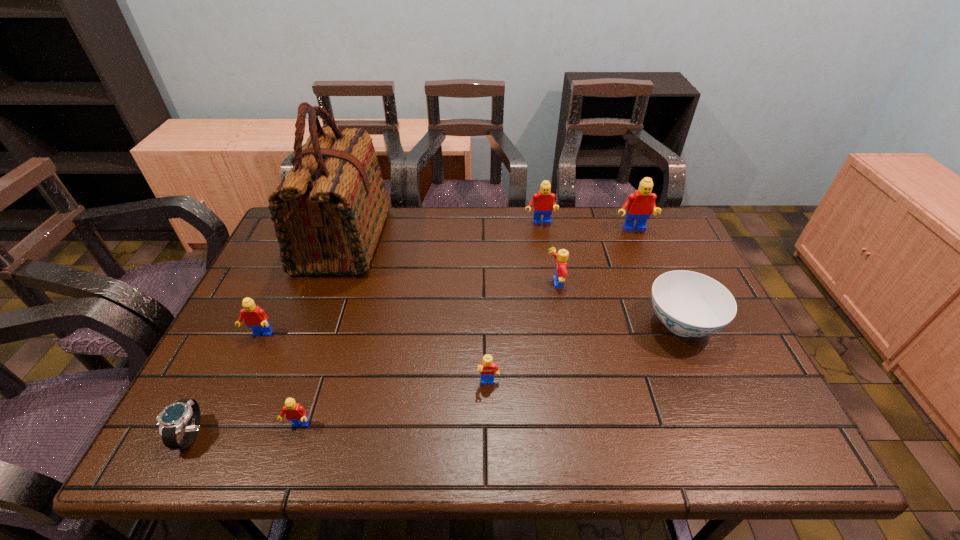
Locate an element on the screen. This screenshot has width=960, height=540. the nearer yellow Lego is located at coordinates (487, 368).

Find the location of a particular element. The height and width of the screenshot is (540, 960). the third nearest object is located at coordinates (487, 368).

I want to click on the second red Lego from left to right, so click(296, 413).

Locate an element on the screen. the smallest red Lego is located at coordinates (296, 413).

Locate an element on the screen. This screenshot has width=960, height=540. silver watch is located at coordinates (171, 420).

The image size is (960, 540). What are the coordinates of `free region located 0.360m on the open handle side of the shopping bag` in the screenshot? It's located at (501, 240).

You are a GUI agent. You are given a task and a screenshot of the screen. Output one action in this format:
    pyautogui.click(x=<x>, y=<y>)
    Task: Click on the vacant space situated on the front-facing side of the rightmost red Lego
    
    Given the screenshot: What is the action you would take?
    pyautogui.click(x=642, y=254)

This screenshot has width=960, height=540. Identify the location of vacant space located on the front-facing side of the second red Lego from right to left. (554, 307).

Image resolution: width=960 pixels, height=540 pixels. I want to click on free space located 0.320m on the face of the right yellow Lego, so click(x=432, y=284).

Where is `vacant space situated on the face of the right yellow Lego`? The image size is (960, 540). vacant space situated on the face of the right yellow Lego is located at coordinates (517, 284).